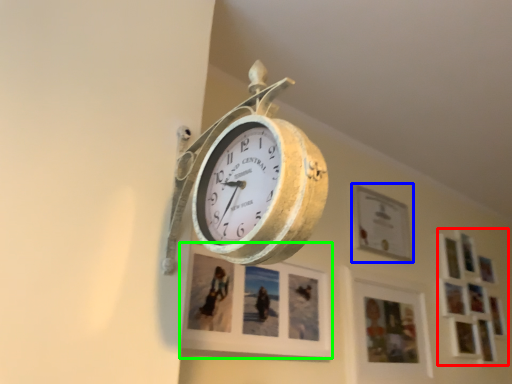
Question: Which object is the farthest from picture frame (highlighted by a red box)? Choose among these: picture frame (highlighted by a blue box) or picture frame (highlighted by a green box).

Choices:
 (A) picture frame
 (B) picture frame

Answer: (B)